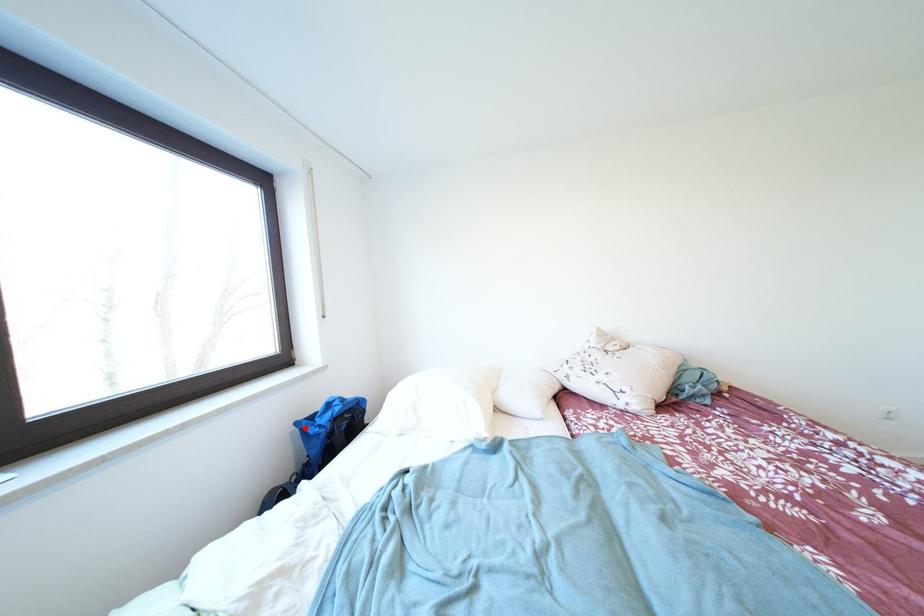
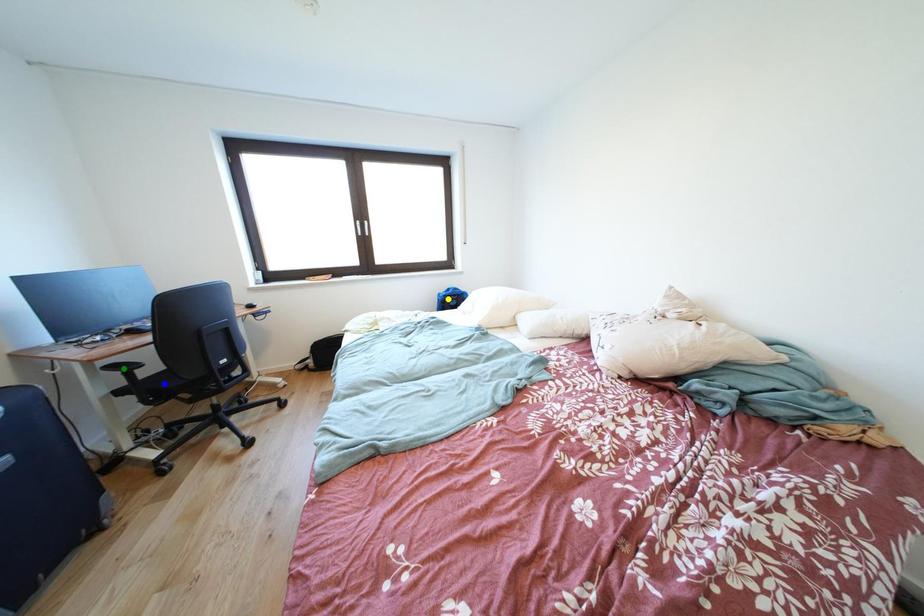
Question: I am providing you with two images of the same scene from different viewpoints. A red point is marked on the first image. You are given multiple points on the second image. Which point in image 2 is actually the same real-world point as the red point in image 1?

Choices:
 (A) green point
 (B) blue point
 (C) yellow point

Answer: (C)